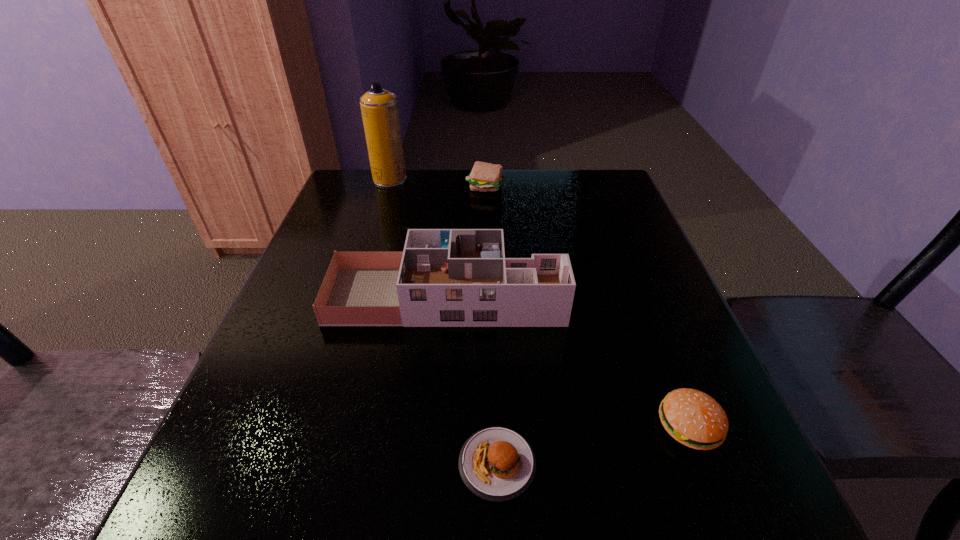
Locate an element on the screen. This screenshot has height=540, width=960. free location that satisfies the following two spatial constraints: 1. on the back side of the shortest object; 2. at the entrance of the dollhouse is located at coordinates (492, 296).

Locate an element on the screen. The height and width of the screenshot is (540, 960). vacant area that satisfies the following two spatial constraints: 1. on the back side of the second shortest object; 2. at the entrance of the third farthest object is located at coordinates (638, 296).